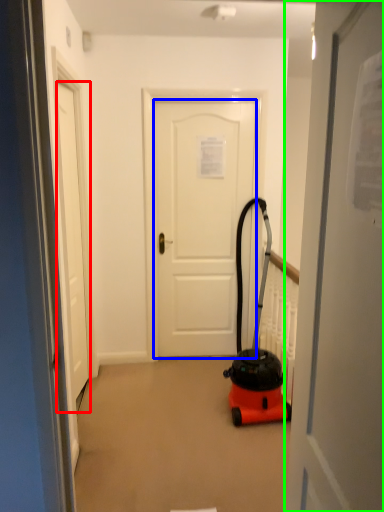
Question: Which object is positioned closest to door (highlighted by a red box)? Select from door (highlighted by a blue box) and door (highlighted by a green box).

Choices:
 (A) door
 (B) door

Answer: (A)